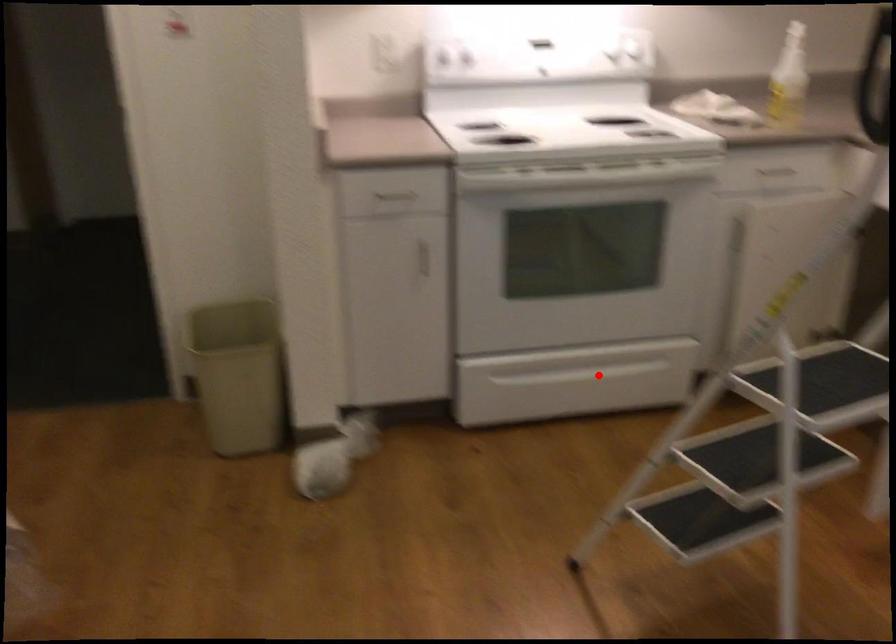
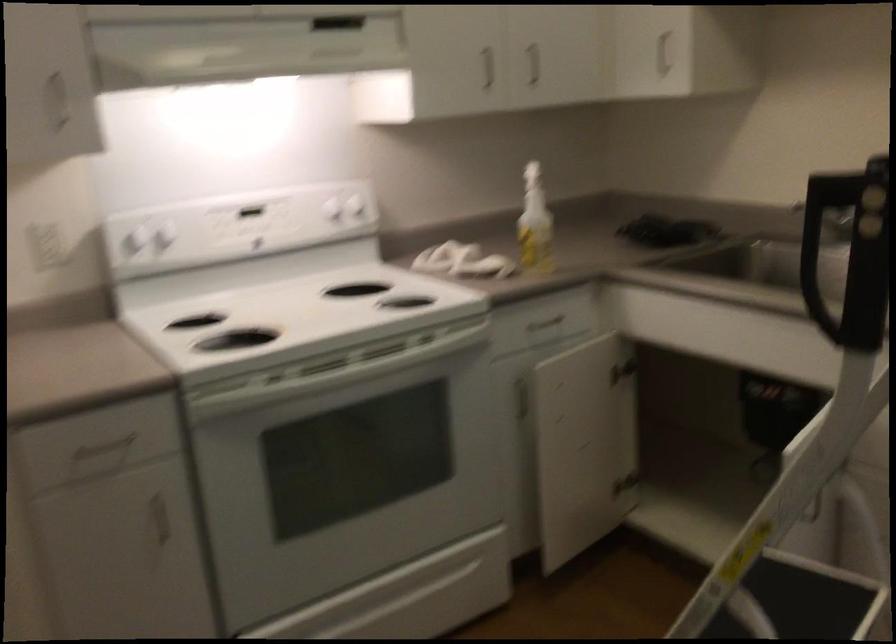
Question: I am providing you with two images of the same scene from different viewpoints. Image1 has a red point marked. In image2, the corresponding 3D location appears at what relative position? Reply with the corresponding letter.

Choices:
 (A) Closer
 (B) Farther

Answer: (A)